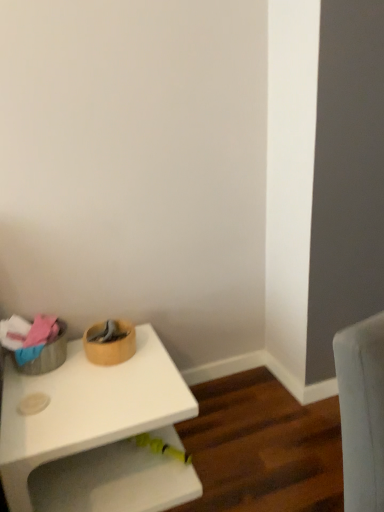
The width and height of the screenshot is (384, 512). Describe the element at coordinates (97, 434) in the screenshot. I see `white matte table at lower left` at that location.

The image size is (384, 512). What are the coordinates of `white matte table at lower left` in the screenshot? It's located at (97, 434).

What is the approximate height of white matte table at lower left?

The height of white matte table at lower left is 15.27 inches.

The image size is (384, 512). What are the coordinates of `white matte table at lower left` in the screenshot? It's located at (97, 434).